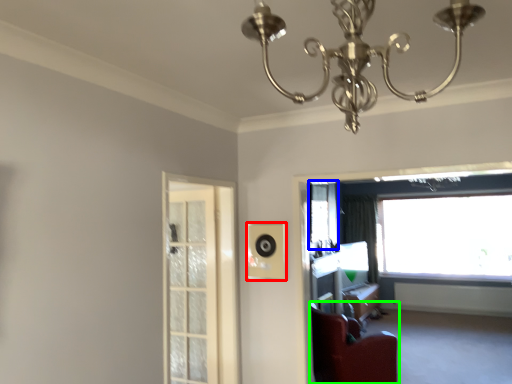
Question: Which object is positioned closest to speaker (highlighted by a red box)? Select from window screen (highlighted by a blue box) and furniture (highlighted by a green box).

Choices:
 (A) window screen
 (B) furniture

Answer: (B)